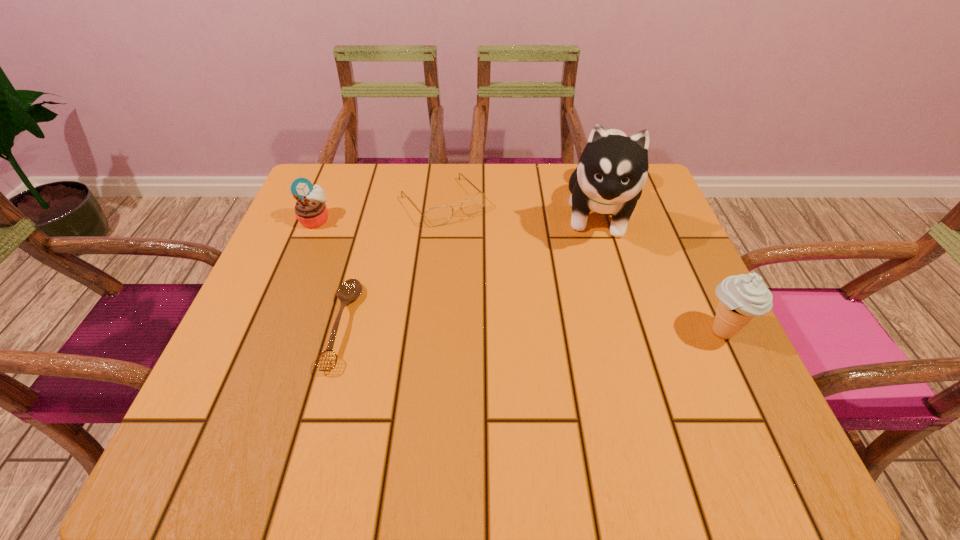
In the image, there is a desktop. At what (x,y) coordinates should I click in order to perform the action: click on vacant space at the far edge. Please return your answer as a coordinate pair (x, y). This screenshot has width=960, height=540. Looking at the image, I should click on (509, 206).

This screenshot has height=540, width=960. In the image, there is a desktop. What are the coordinates of `free region at the near edge` in the screenshot? It's located at (593, 390).

You are a GUI agent. You are given a task and a screenshot of the screen. Output one action in this format:
    pyautogui.click(x=<x>, y=<y>)
    Task: Click on the vacant region at the left edge
    
    Given the screenshot: What is the action you would take?
    (303, 246)

In the image, there is a desktop. Identify the location of vacant space at the right edge. (723, 355).

The image size is (960, 540). What are the coordinates of `vacant space at the near left corner of the desktop` in the screenshot? It's located at (x=300, y=375).

This screenshot has width=960, height=540. I want to click on free spot at the near right corner of the desktop, so click(x=704, y=373).

Find the location of a particular element. The height and width of the screenshot is (540, 960). free area in between the fourth object from right to left and the rightmost object is located at coordinates (532, 328).

Image resolution: width=960 pixels, height=540 pixels. Find the location of `vacant space that is in between the rightmost object and the ladle`. vacant space that is in between the rightmost object and the ladle is located at coordinates (532, 328).

The image size is (960, 540). Identify the location of free space between the rightmost object and the second shortest object. (582, 267).

Image resolution: width=960 pixels, height=540 pixels. Identify the location of free space between the fourth object from left to right and the third tallest object. point(458,216).